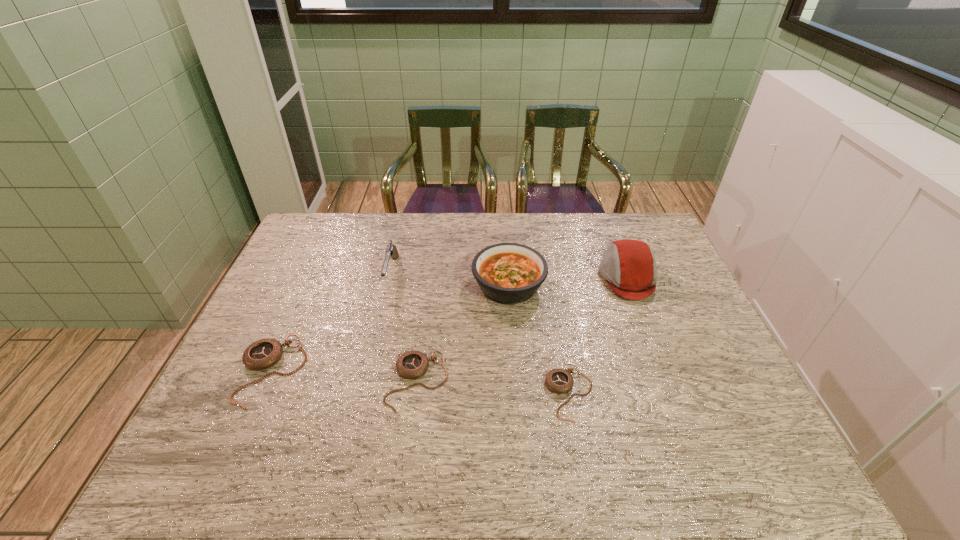
This screenshot has height=540, width=960. I want to click on vacant position located on the right of the second tallest pocket watch, so click(x=567, y=381).

Image resolution: width=960 pixels, height=540 pixels. I want to click on vacant space situated 0.230m on the back of the shortest pocket watch, so [554, 303].

This screenshot has height=540, width=960. What are the coordinates of `vacant space located 0.200m aiming along the barrel of the gun` in the screenshot? It's located at tap(374, 346).

Where is `free space located 0.330m on the front-facing side of the rightmost object`? The width and height of the screenshot is (960, 540). free space located 0.330m on the front-facing side of the rightmost object is located at coordinates (496, 278).

Identify the location of vacant region located on the front-facing side of the rightmost object. Image resolution: width=960 pixels, height=540 pixels. (518, 278).

Find the location of a particular element. vacant region located 0.170m on the front-facing side of the rightmost object is located at coordinates (546, 278).

Where is `vacant space located on the left of the stew`? vacant space located on the left of the stew is located at coordinates (372, 285).

Image resolution: width=960 pixels, height=540 pixels. What are the coordinates of `object that is at the left edge` in the screenshot? It's located at (262, 354).

The width and height of the screenshot is (960, 540). What are the coordinates of `object that is at the right edge` in the screenshot? It's located at (629, 267).

At what (x,y) coordinates should I click in order to perform the action: click on object at the near left corner. Please return your answer as a coordinate pair (x, y). The height and width of the screenshot is (540, 960). Looking at the image, I should click on (262, 354).